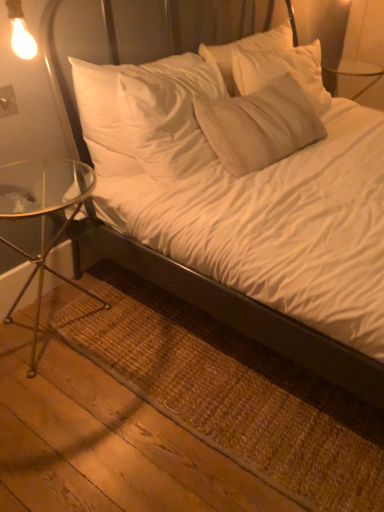
Question: Is white soft bed at center further to camera compared to brown woven mat at lower left?

Choices:
 (A) yes
 (B) no

Answer: (B)

Question: Is white soft bed at center bigger than brown woven mat at lower left?

Choices:
 (A) yes
 (B) no

Answer: (A)

Question: From the image's perspective, is white soft bed at center above brown woven mat at lower left?

Choices:
 (A) no
 (B) yes

Answer: (B)

Question: Could you tell me if white soft bed at center is facing brown woven mat at lower left?

Choices:
 (A) yes
 (B) no

Answer: (B)

Question: Is white soft bed at center not inside brown woven mat at lower left?

Choices:
 (A) yes
 (B) no

Answer: (A)

Question: Is white soft bed at center positioned before brown woven mat at lower left?

Choices:
 (A) no
 (B) yes

Answer: (B)

Question: Does white soft bed at center appear on the left side of clear glass table at left?

Choices:
 (A) no
 (B) yes

Answer: (A)

Question: Considering the relative sizes of white soft bed at center and clear glass table at left in the image provided, is white soft bed at center shorter than clear glass table at left?

Choices:
 (A) no
 (B) yes

Answer: (A)

Question: Could clear glass table at left be considered to be inside white soft bed at center?

Choices:
 (A) no
 (B) yes

Answer: (A)

Question: Can you confirm if white soft bed at center is smaller than clear glass table at left?

Choices:
 (A) no
 (B) yes

Answer: (A)

Question: From the image's perspective, would you say white soft bed at center is positioned over clear glass table at left?

Choices:
 (A) no
 (B) yes

Answer: (B)

Question: Is white soft bed at center oriented towards clear glass table at left?

Choices:
 (A) no
 (B) yes

Answer: (A)

Question: Is brown woven mat at lower left further to camera compared to white soft bed at center?

Choices:
 (A) no
 (B) yes

Answer: (B)